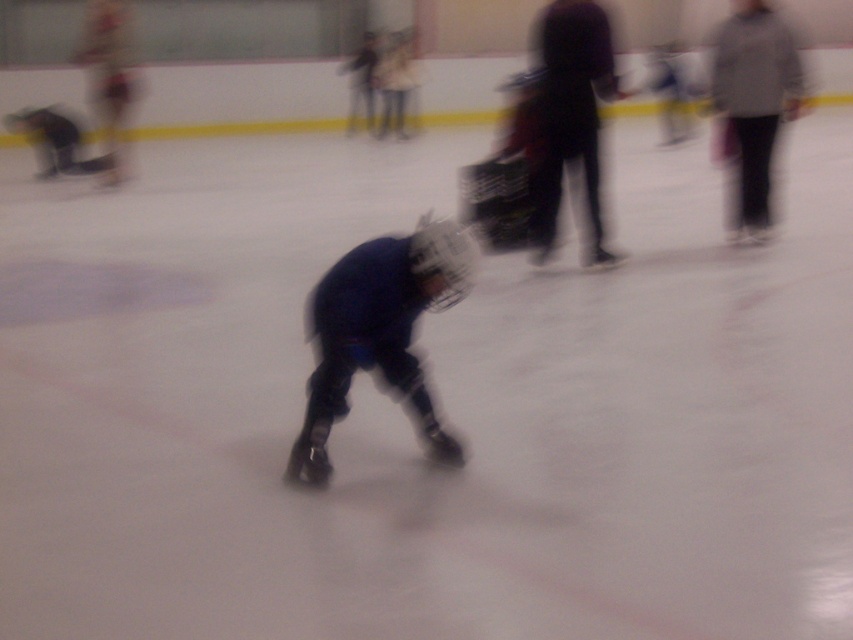
Question: Observing the image, what is the correct spatial positioning of blue padded jacket at center in reference to gray wool sweater at upper right?

Choices:
 (A) left
 (B) right

Answer: (A)

Question: Which point appears farthest from the camera in this image?

Choices:
 (A) (364, 352)
 (B) (740, 99)

Answer: (B)

Question: Does blue padded jacket at center have a larger size compared to gray wool sweater at upper right?

Choices:
 (A) no
 (B) yes

Answer: (A)

Question: Does blue padded jacket at center have a greater width compared to gray wool sweater at upper right?

Choices:
 (A) yes
 (B) no

Answer: (A)